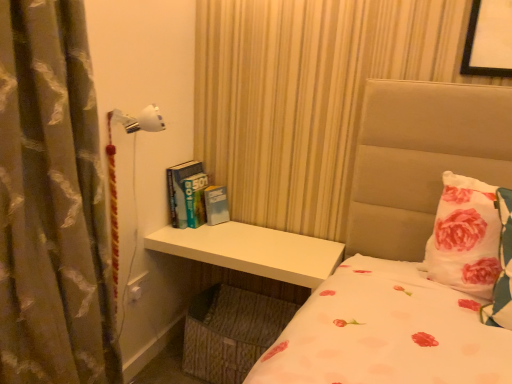
The image size is (512, 384). What are the coordinates of `white glossy table at lower center` in the screenshot? It's located at (253, 251).

What do you see at coordinates (253, 251) in the screenshot? Image resolution: width=512 pixels, height=384 pixels. I see `white glossy table at lower center` at bounding box center [253, 251].

Locate an element on the screen. The image size is (512, 384). silky brown curtain at left is located at coordinates (52, 203).

Where is `hardcover books at center`? hardcover books at center is located at coordinates (195, 197).

Which of these two, white floral pillow at right or hardcover books at center, stands shorter?

Standing shorter between the two is hardcover books at center.

Could you tell me if white floral pillow at right is turned towards hardcover books at center?

No, white floral pillow at right is not facing towards hardcover books at center.

From the image's perspective, relative to hardcover books at center, is white floral pillow at right above or below?

Clearly, from the image's perspective, white floral pillow at right is below hardcover books at center.

From the picture: Does white floral pillow at right touch hardcover books at center?

No, white floral pillow at right is not making contact with hardcover books at center.

Do you think white floral pillow at right is within white glossy table at lower center, or outside of it?

white floral pillow at right is outside white glossy table at lower center.

Does point (439, 282) come in front of point (223, 225)?

Yes, it is in front of point (223, 225).

Which object is wider, white floral pillow at right or white glossy table at lower center?

white glossy table at lower center.

Is hardcover books at center not near white glossy table at lower center?

No, there isn't a large distance between hardcover books at center and white glossy table at lower center.

Is hardcover books at center bigger than white glossy table at lower center?

Incorrect, hardcover books at center is not larger than white glossy table at lower center.

Which of these two, hardcover books at center or white glossy table at lower center, stands shorter?

Standing shorter between the two is hardcover books at center.

From the image's perspective, does white glossy table at lower center appear lower than hardcover books at center?

Yes, from the image's perspective, white glossy table at lower center is below hardcover books at center.

From a real-world perspective, is white glossy table at lower center physically above hardcover books at center?

No.

Locate an element on the screen. The width and height of the screenshot is (512, 384). table located below the hardcover books at center (from the image's perspective) is located at coordinates (253, 251).

Considering the positions of point (287, 254) and point (183, 186), is point (287, 254) closer or farther from the camera than point (183, 186)?

Point (287, 254) is positioned closer to the camera compared to point (183, 186).

From the image's perspective, is white glossy table at lower center on top of white floral pillow at right?

Incorrect, from the image's perspective, white glossy table at lower center is lower than white floral pillow at right.

Measure the distance between white glossy table at lower center and white floral pillow at right.

60.70 centimeters.

From a real-world perspective, is white glossy table at lower center above or below white floral pillow at right?

Clearly, from a real-world perspective, white glossy table at lower center is below white floral pillow at right.

Is white glossy table at lower center bigger than white floral pillow at right?

Correct, white glossy table at lower center is larger in size than white floral pillow at right.

Looking at this image, is silky brown curtain at left aimed at white floral pillow at right?

No, silky brown curtain at left is not turned towards white floral pillow at right.

Which is in front, silky brown curtain at left or white floral pillow at right?

silky brown curtain at left.

How distant is silky brown curtain at left from white floral pillow at right?

They are 1.22 meters apart.

From a real-world perspective, is silky brown curtain at left physically located above or below hardcover books at center?

Clearly, from a real-world perspective, silky brown curtain at left is above hardcover books at center.

Can you confirm if silky brown curtain at left is thinner than hardcover books at center?

No, silky brown curtain at left is not thinner than hardcover books at center.

From the image's perspective, between silky brown curtain at left and hardcover books at center, which one is located above?

hardcover books at center, from the image's perspective.

The width and height of the screenshot is (512, 384). In order to click on book lying on the left of white floral pillow at right in this screenshot , I will do `click(195, 197)`.

In order to click on pillow that appears on the right of white glossy table at lower center in this screenshot , I will do `click(465, 237)`.

From the image, which object appears to be nearer to white floral pillow at right, white glossy table at lower center or hardcover books at center?

white glossy table at lower center is closer to white floral pillow at right.

From the picture: When comparing their distances from white floral pillow at right, does silky brown curtain at left or hardcover books at center seem closer?

Based on the image, hardcover books at center appears to be nearer to white floral pillow at right.

In the scene shown: Considering their positions, is hardcover books at center positioned closer to white glossy table at lower center than white floral pillow at right?

Based on the image, hardcover books at center appears to be nearer to white glossy table at lower center.

Looking at the image, which one is located further to white glossy table at lower center, white floral pillow at right or hardcover books at center?

white floral pillow at right is further to white glossy table at lower center.

Based on their spatial positions, is white floral pillow at right or hardcover books at center further from silky brown curtain at left?

The object further to silky brown curtain at left is white floral pillow at right.

Estimate the real-world distances between objects in this image. Which object is further from hardcover books at center, white glossy table at lower center or silky brown curtain at left?

Based on the image, silky brown curtain at left appears to be further to hardcover books at center.

Estimate the real-world distances between objects in this image. Which object is closer to silky brown curtain at left, hardcover books at center or white floral pillow at right?

Among the two, hardcover books at center is located nearer to silky brown curtain at left.

Considering their positions, is white glossy table at lower center positioned closer to hardcover books at center than white floral pillow at right?

The object closer to hardcover books at center is white glossy table at lower center.

This screenshot has height=384, width=512. Find the location of `table situated between hardcover books at center and white floral pillow at right from left to right`. table situated between hardcover books at center and white floral pillow at right from left to right is located at coordinates (253, 251).

The height and width of the screenshot is (384, 512). I want to click on table between silky brown curtain at left and white floral pillow at right, so tap(253, 251).

Locate an element on the screen. This screenshot has height=384, width=512. book situated between silky brown curtain at left and white floral pillow at right from left to right is located at coordinates (195, 197).

Where is `table between silky brown curtain at left and hardcover books at center in the front-back direction`? The width and height of the screenshot is (512, 384). table between silky brown curtain at left and hardcover books at center in the front-back direction is located at coordinates (253, 251).